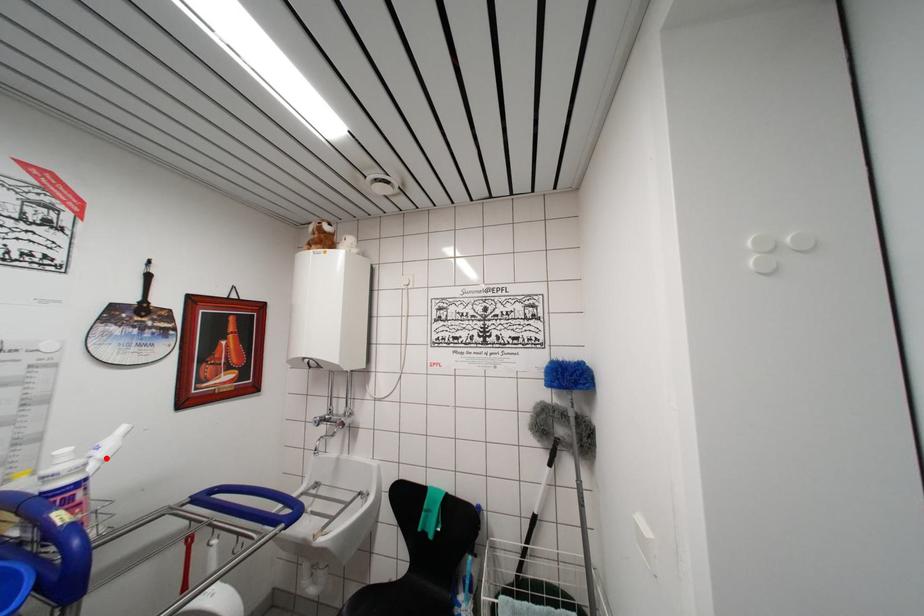
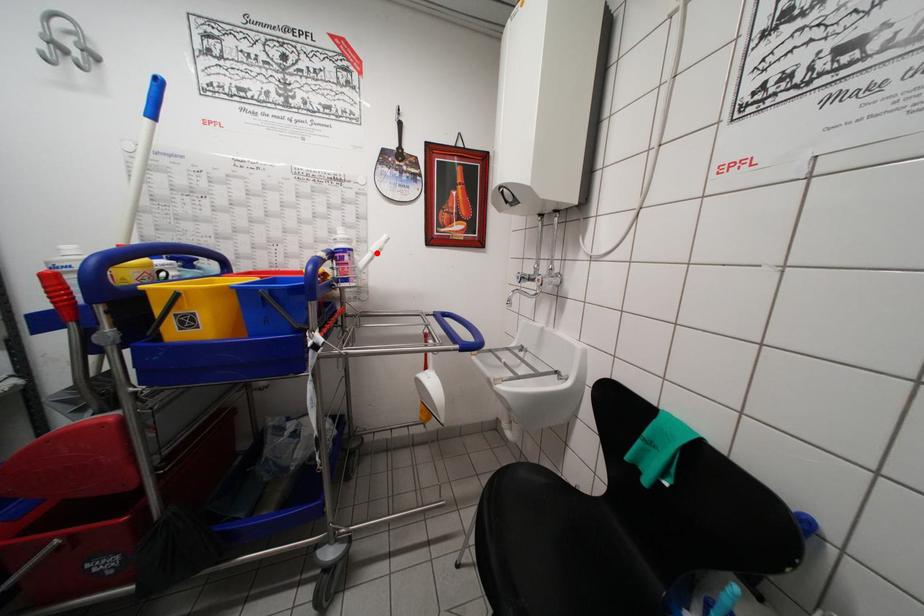
I am providing you with two images of the same scene from different viewpoints. A red point is marked on the first image and another point is marked on the second image. Do the highlighted points in image1 and image2 indicate the same real-world spot?

Yes